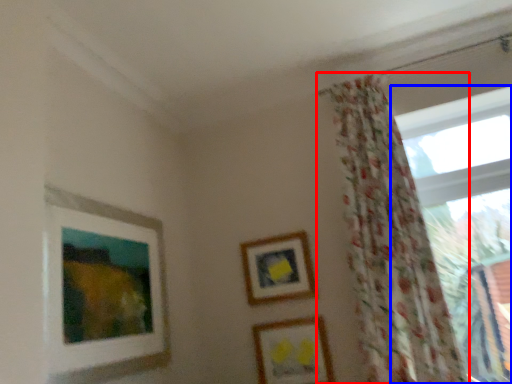
Question: Which object is closer to the camera taking this photo, curtain (highlighted by a red box) or window (highlighted by a blue box)?

Choices:
 (A) curtain
 (B) window

Answer: (A)